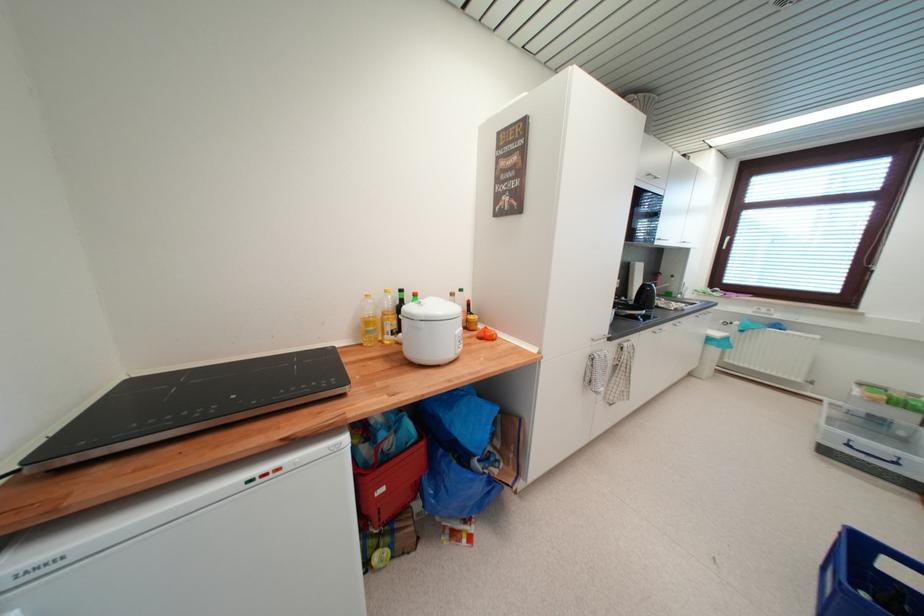
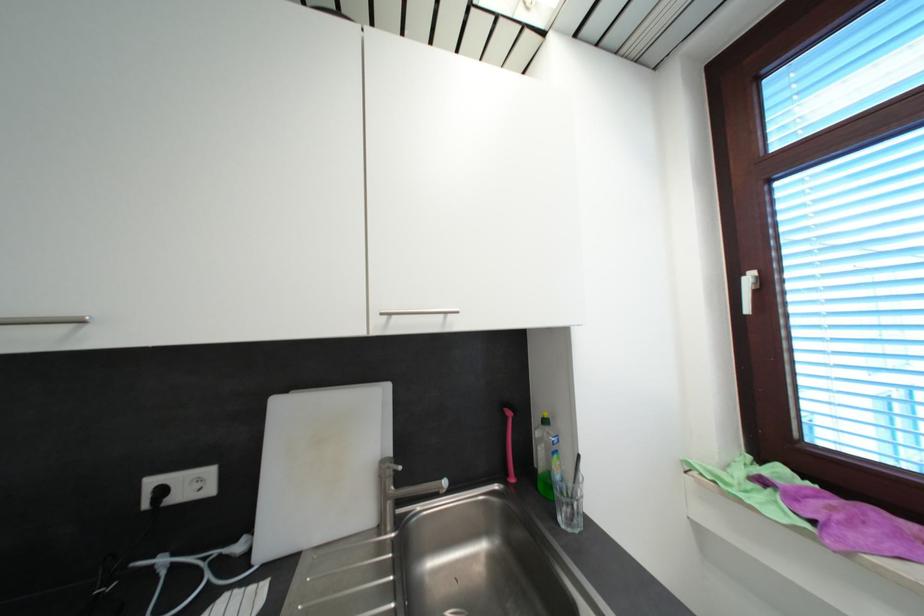
Looking at this image, what movement of the cameraman would produce the second image?

The cameraman moved toward right, forward.